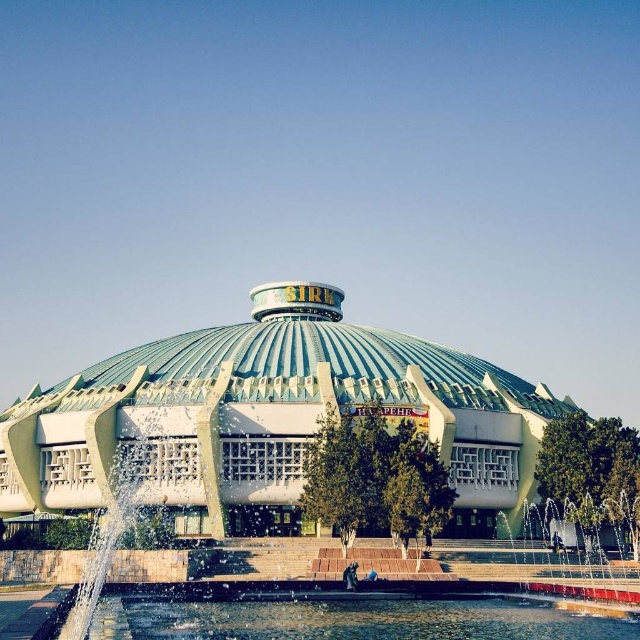
You are an architect evaluating the design of the building. Based on the provided image, which object occupies a greater area in the scene between the green metallic dome at center and the clear water at bottom?

The green metallic dome at center is larger in size than the clear water at bottom, so it occupies a greater area in the scene.

You are an architect analyzing the proportions of the building. Given that the green metallic dome at center and the clear water at bottom are key elements, which one has a greater width according to the scene?

The green metallic dome at center has a greater width than the clear water at bottom.

You are standing in front of the architectural structure and want to take a photo that includes both the green metallic dome at center and the clear water at bottom. Based on their positions, which object should you place closer to the left side of your camera frame?

The green metallic dome at center is positioned on the left side of clear water at bottom, so to include both in the photo, you should place the green metallic dome at center closer to the left side of your camera frame.